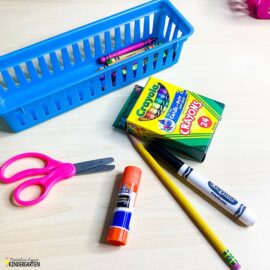
Find the location of a particular element. This screenshot has height=270, width=270. marker is located at coordinates (224, 198).